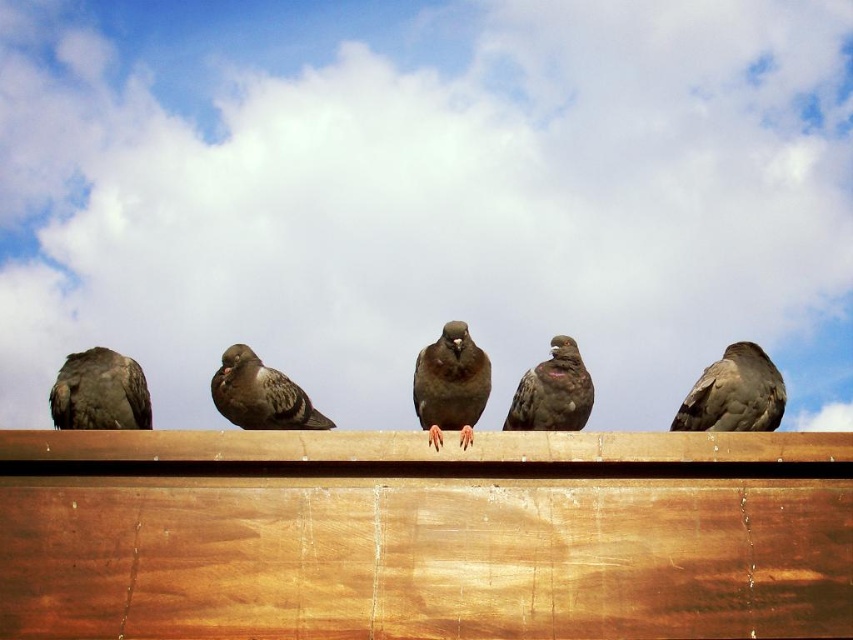
Question: Can you confirm if brown feathered pigeon at left is bigger than brown speckled pigeon at center?

Choices:
 (A) no
 (B) yes

Answer: (A)

Question: Which point is farther to the camera?

Choices:
 (A) brown matte pigeon at center
 (B) brown speckled pigeon at center
 (C) gray matte pigeon at center
 (D) brown feathered pigeon at left

Answer: (D)

Question: Is brown matte pigeon at center closer to the viewer compared to brown speckled pigeon at center?

Choices:
 (A) yes
 (B) no

Answer: (A)

Question: Is brown matte pigeon at center to the left of gray matte pigeon at center from the viewer's perspective?

Choices:
 (A) yes
 (B) no

Answer: (B)

Question: Which of these objects is positioned farthest from the brown matte pigeon at center?

Choices:
 (A) brown feathered pigeon at left
 (B) gray matte pigeon at center
 (C) brown feathered pigeon at center

Answer: (A)

Question: Which object is the closest to the gray matte pigeon at center?

Choices:
 (A) brown matte pigeon at center
 (B) brown feathered pigeon at center

Answer: (A)